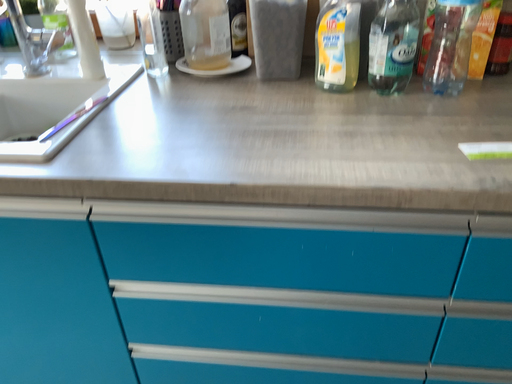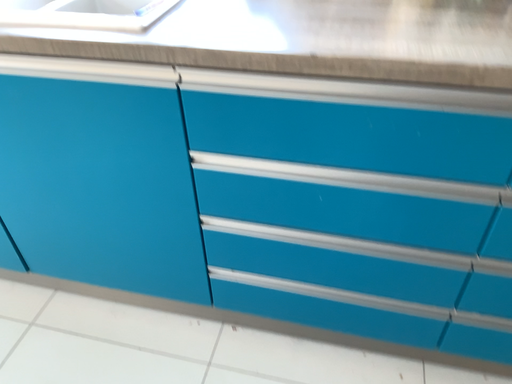
Question: How did the camera likely rotate when shooting the video?

Choices:
 (A) rotated right
 (B) rotated left

Answer: (B)